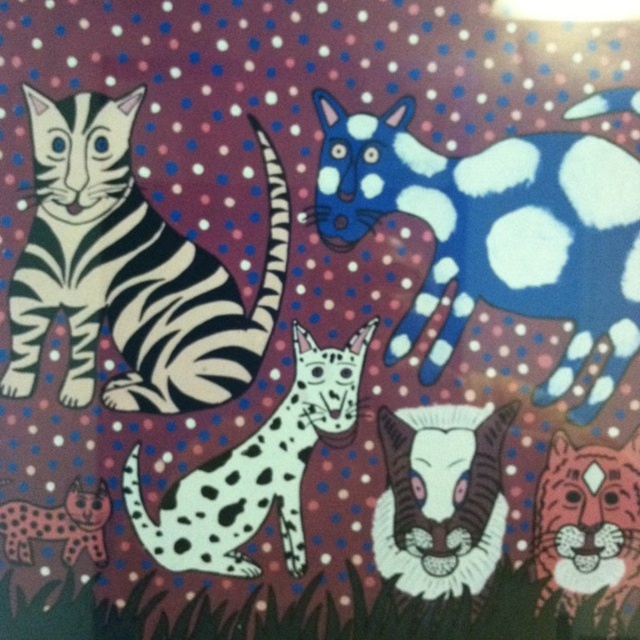
Question: Estimate the real-world distances between objects in this image. Which object is closer to the white fur cat at center?

Choices:
 (A) spotted fur cat at lower left
 (B) blue spotted cat at upper right

Answer: (B)

Question: Does speckled fur cat at center appear on the right side of white fur cat at center?

Choices:
 (A) yes
 (B) no

Answer: (B)

Question: Is white fur cat at center wider than orange tiger face at lower right?

Choices:
 (A) no
 (B) yes

Answer: (B)

Question: Which object is the closest to the orange tiger face at lower right?

Choices:
 (A) blue spotted cat at upper right
 (B) speckled fur cat at center

Answer: (A)

Question: Can you confirm if black and white striped cat at left is bigger than white fur cat at center?

Choices:
 (A) no
 (B) yes

Answer: (B)

Question: Which point is farther to the camera?

Choices:
 (A) orange tiger face at lower right
 (B) speckled fur cat at center

Answer: (B)